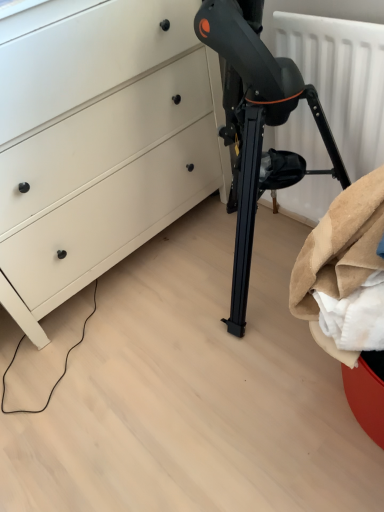
Find the location of a particular element. The image size is (384, 512). blank space above white matte radiator at upper right (from a real-world perspective) is located at coordinates point(332,8).